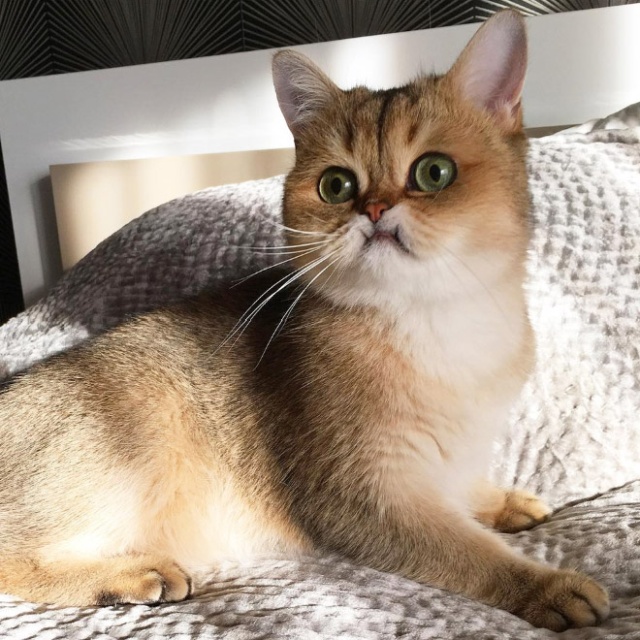
Locate an element on the screen. This screenshot has width=640, height=640. headboard is located at coordinates (212, 127).